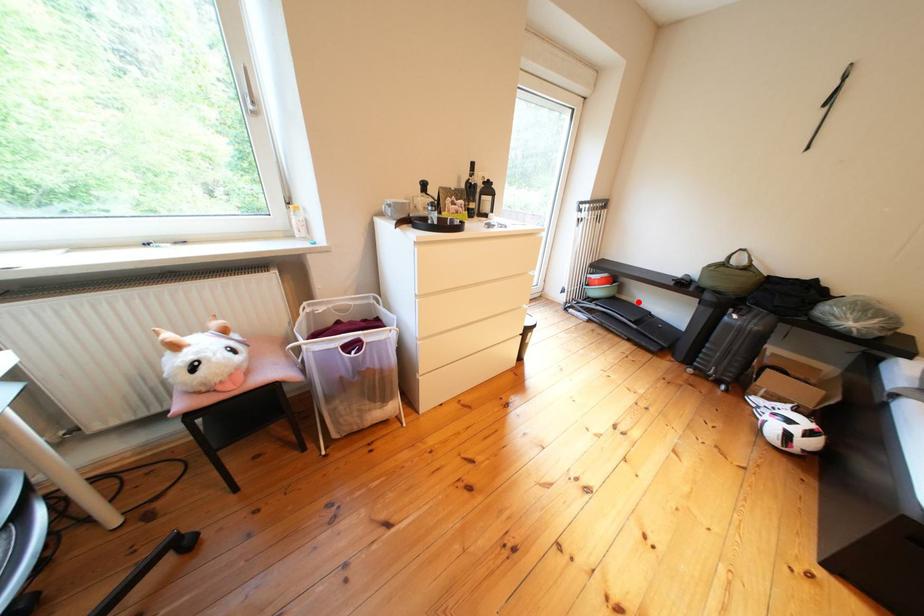
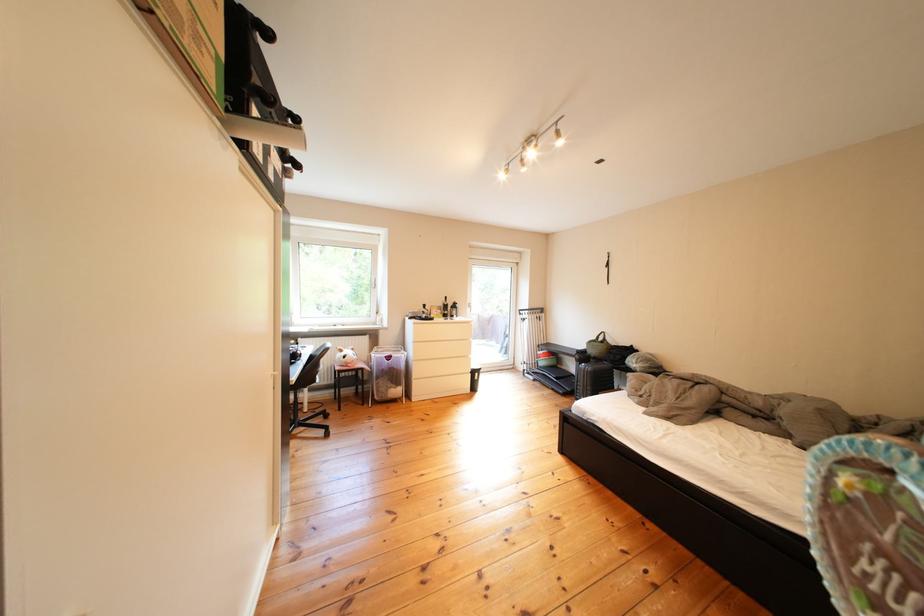
The point at the highlighted location is marked in the first image. Where is the corresponding point in the second image?

(578, 371)